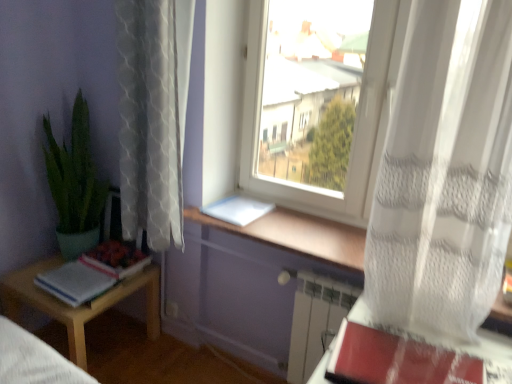
Question: From the image's perspective, would you say white plastic window at center is positioned over red matte paperback book at lower right, placed as the second paperback book when sorted from left to right?

Choices:
 (A) no
 (B) yes

Answer: (B)

Question: Is white plastic window at center shorter than red matte paperback book at lower right, the first paperback book from the right?

Choices:
 (A) no
 (B) yes

Answer: (A)

Question: Is white plastic window at center thinner than red matte paperback book at lower right, which is the 1th paperback book from bottom to top?

Choices:
 (A) yes
 (B) no

Answer: (A)

Question: From the image's perspective, is white plastic window at center beneath red matte paperback book at lower right, placed as the second paperback book when sorted from left to right?

Choices:
 (A) yes
 (B) no

Answer: (B)

Question: Can you confirm if white plastic window at center is smaller than red matte paperback book at lower right, which is the 1th paperback book from bottom to top?

Choices:
 (A) no
 (B) yes

Answer: (A)

Question: In terms of size, does white plastic window at center appear bigger or smaller than white paper book at lower left?

Choices:
 (A) small
 (B) big

Answer: (B)

Question: Is point (273, 13) positioned closer to the camera than point (98, 279)?

Choices:
 (A) closer
 (B) farther

Answer: (B)

Question: In the image, is white plastic window at center positioned in front of or behind white paper book at lower left?

Choices:
 (A) behind
 (B) front

Answer: (B)

Question: From the image's perspective, is white plastic window at center positioned above or below white paper book at lower left?

Choices:
 (A) below
 (B) above

Answer: (B)

Question: Relative to white paper at window, the first paperback book positioned from the left, is light wood table at lower left in front or behind?

Choices:
 (A) front
 (B) behind

Answer: (A)

Question: Would you say light wood table at lower left is inside or outside white paper at window, the first paperback book positioned from the left?

Choices:
 (A) inside
 (B) outside

Answer: (B)

Question: Would you say light wood table at lower left is to the left or to the right of white paper at window, the 1th paperback book viewed from the top, in the picture?

Choices:
 (A) right
 (B) left

Answer: (B)

Question: From a real-world perspective, is light wood table at lower left positioned above or below white paper at window, placed as the second paperback book when sorted from bottom to top?

Choices:
 (A) below
 (B) above

Answer: (A)

Question: Is green matte plant at left inside or outside of white sheer curtain at right, which is the 1th curtain from right to left?

Choices:
 (A) inside
 (B) outside

Answer: (B)

Question: In the image, is green matte plant at left positioned in front of or behind white sheer curtain at right, which is the 1th curtain from right to left?

Choices:
 (A) behind
 (B) front

Answer: (A)